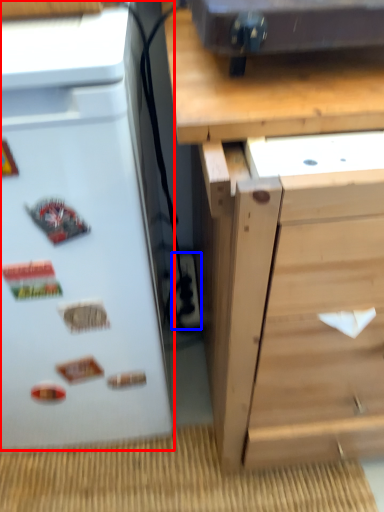
Question: Among these objects, which one is nearest to the camera, refrigerator (highlighted by a red box) or electric outlet (highlighted by a blue box)?

Choices:
 (A) refrigerator
 (B) electric outlet

Answer: (A)